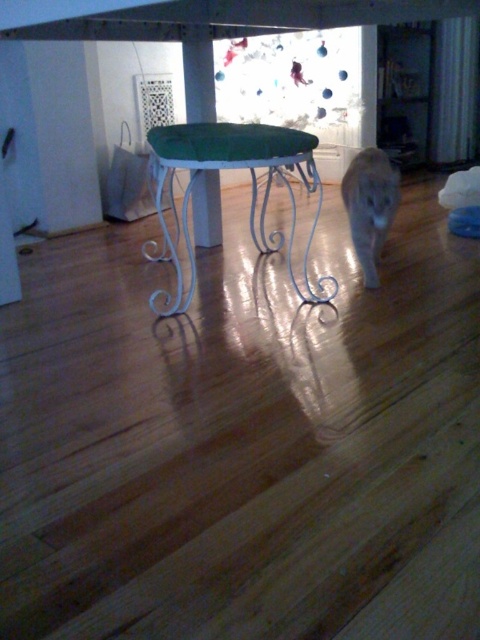
Based on the photo, you are standing at the entrance of the room and want to place a small potted plant on the white wrought iron table at center. Based on the coordinates provided, can you confirm if the table is positioned in the center of the room?

The white wrought iron table at center is located at point coordinates (251, 195), which indicates it is positioned near the center of the room.

You are standing at the entrance of the room and see two points marked in the image. The first point is at coordinates point (164, 182) and the second is at point (374, 250). Which point is closer to you?

Point (164, 182) is in front of point (374, 250), so it is closer to you.

You are a photographer trying to capture the Christmas tree through the window. You notice the white wrought iron table at center and the gray fur cat at center are blocking your view. Which object should you move to get a clearer shot of the window?

You should move the gray fur cat at center because the white wrought iron table at center is taller and harder to move out of the way compared to the gray fur cat at center.